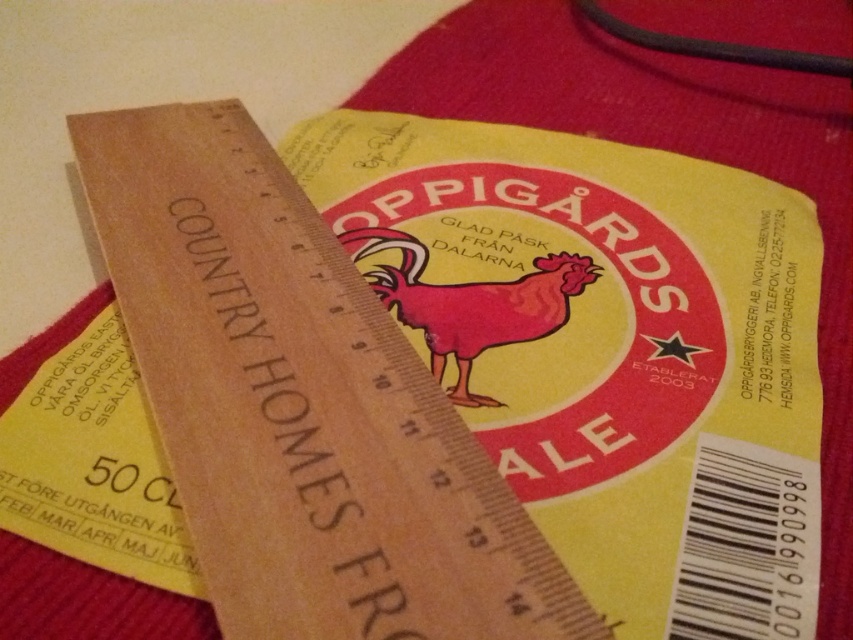
In the scene shown: Does wooden ruler at center have a smaller size compared to matte red chicken at center?

Incorrect, wooden ruler at center is not smaller in size than matte red chicken at center.

Is wooden ruler at center to the left of matte red chicken at center from the viewer's perspective?

Indeed, wooden ruler at center is positioned on the left side of matte red chicken at center.

Is point (299, 598) behind point (430, 320)?

No, it is not.

Find the location of a particular element. wooden ruler at center is located at coordinates (300, 404).